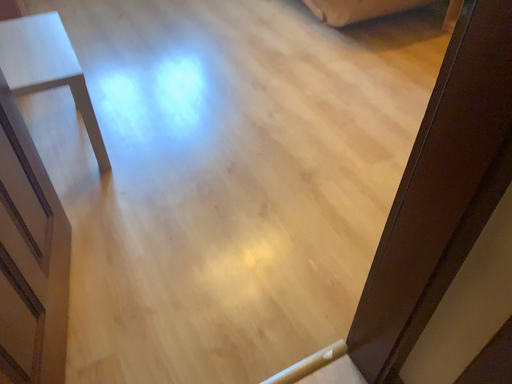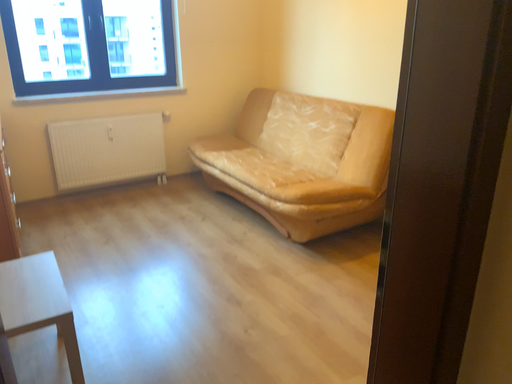
Question: Which way did the camera rotate in the video?

Choices:
 (A) rotated upward
 (B) rotated downward

Answer: (A)